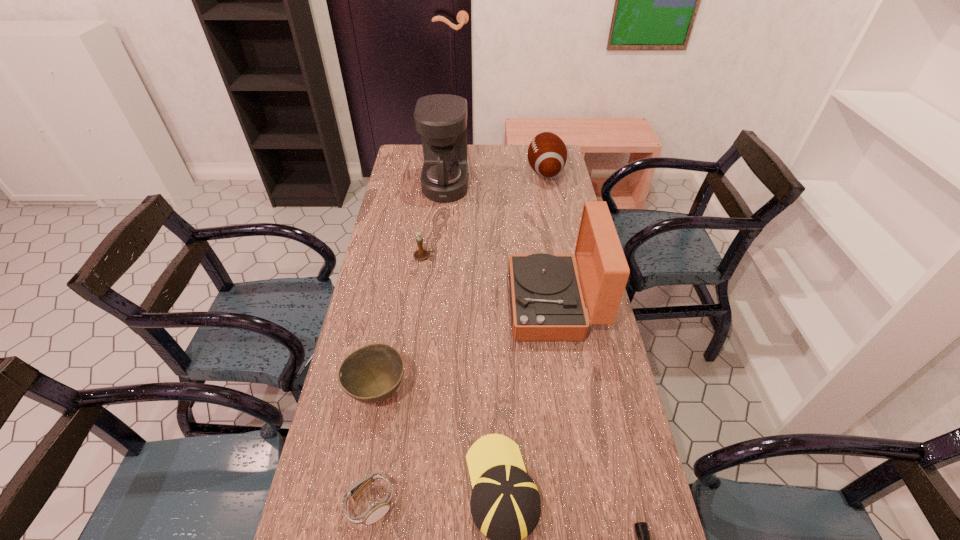
This screenshot has width=960, height=540. Find the location of `the tallest object`. the tallest object is located at coordinates (441, 119).

You are a GUI agent. You are given a task and a screenshot of the screen. Output one action in this format:
    pyautogui.click(x=<x>, y=<y>)
    Task: Click on the second tallest object
    The image size is (960, 540).
    Given the screenshot: What is the action you would take?
    pyautogui.click(x=547, y=304)

You are a GUI agent. You are given a task and a screenshot of the screen. Output one action in this format:
    pyautogui.click(x=<x>, y=<y>)
    Task: Click on the fifth nearest object
    The height and width of the screenshot is (540, 960).
    Given the screenshot: What is the action you would take?
    pyautogui.click(x=547, y=304)

This screenshot has width=960, height=540. Identify the location of football. (547, 154).

What are the coordinates of `candle holder` in the screenshot? It's located at (420, 254).

Where is `the fourth nearest object`? This screenshot has height=540, width=960. the fourth nearest object is located at coordinates 372,373.

This screenshot has width=960, height=540. What are the coordinates of `watch` in the screenshot? It's located at coord(377,510).

The image size is (960, 540). I want to click on free location located on the button side of the coffee maker, so click(545, 186).

This screenshot has height=540, width=960. Identify the location of vacant space situated 0.330m on the face of the second tallest object. (409, 303).

Where is `blank area located on the face of the second tallest object`? The width and height of the screenshot is (960, 540). blank area located on the face of the second tallest object is located at coordinates (467, 303).